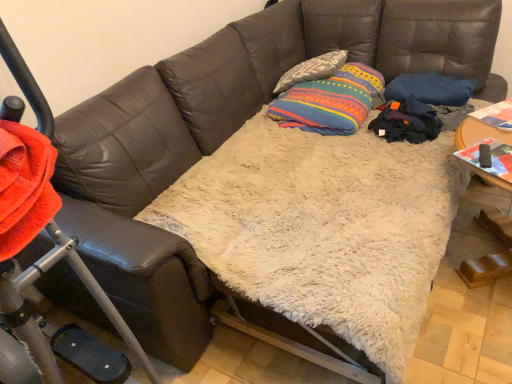
Question: Based on their sizes in the image, would you say textured gray pillow at upper center is bigger or smaller than multicolored striped fabric at center?

Choices:
 (A) big
 (B) small

Answer: (B)

Question: Would you say textured gray pillow at upper center is to the left or to the right of multicolored striped fabric at center in the picture?

Choices:
 (A) left
 (B) right

Answer: (A)

Question: In the image, is textured gray pillow at upper center positioned in front of or behind multicolored striped fabric at center?

Choices:
 (A) behind
 (B) front

Answer: (A)

Question: In terms of height, does multicolored striped fabric at center look taller or shorter compared to textured gray pillow at upper center?

Choices:
 (A) tall
 (B) short

Answer: (A)

Question: Looking at their shapes, would you say multicolored striped fabric at center is wider or thinner than textured gray pillow at upper center?

Choices:
 (A) wide
 (B) thin

Answer: (A)

Question: Considering the relative positions of multicolored striped fabric at center and textured gray pillow at upper center in the image provided, is multicolored striped fabric at center to the left or to the right of textured gray pillow at upper center?

Choices:
 (A) right
 (B) left

Answer: (A)

Question: Considering the positions of point (297, 84) and point (320, 62), is point (297, 84) closer or farther from the camera than point (320, 62)?

Choices:
 (A) closer
 (B) farther

Answer: (A)